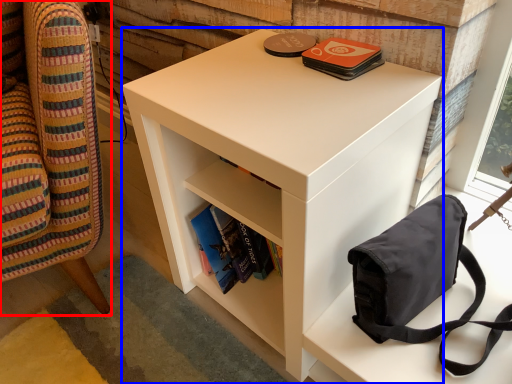
Question: Which object appears farthest to the camera in this image, furniture (highlighted by a red box) or nightstand (highlighted by a blue box)?

Choices:
 (A) furniture
 (B) nightstand

Answer: (B)